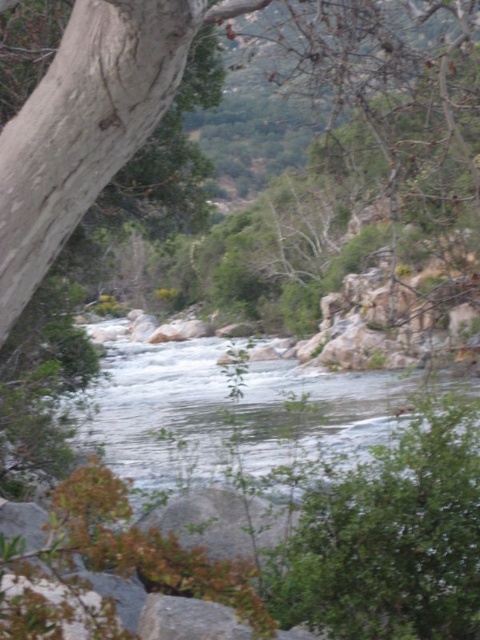
You are a hiker who wants to cross the river at the location shown in the image. You see the clear water at center and the gray rough rock at center. Which one is a safer path to step on?

The gray rough rock at center is a safer path to step on because it is located above the clear water at center, making it more stable and less likely to be slippery.

In the scene shown: You are standing at the point marked as point (233, 412). What is visible at your current location?

At point (233, 412) lies clear water at center.

You are a kayaker planning to navigate through the river shown in the image. You see the clear water at center and the gray rough rock at center. Which object should you avoid to stay in the main current?

You should avoid the gray rough rock at center because the clear water at center is positioned on its left side, indicating the main current flows around the rock. Staying in the clear water area will keep you in the main current.